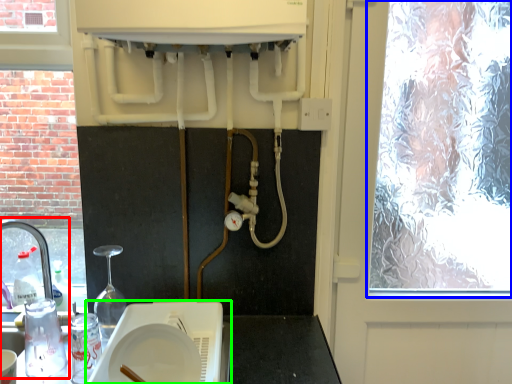
Question: Which is nearer to the sink (highlighted by a red box)? window (highlighted by a blue box) or appliance (highlighted by a green box).

Choices:
 (A) window
 (B) appliance

Answer: (B)